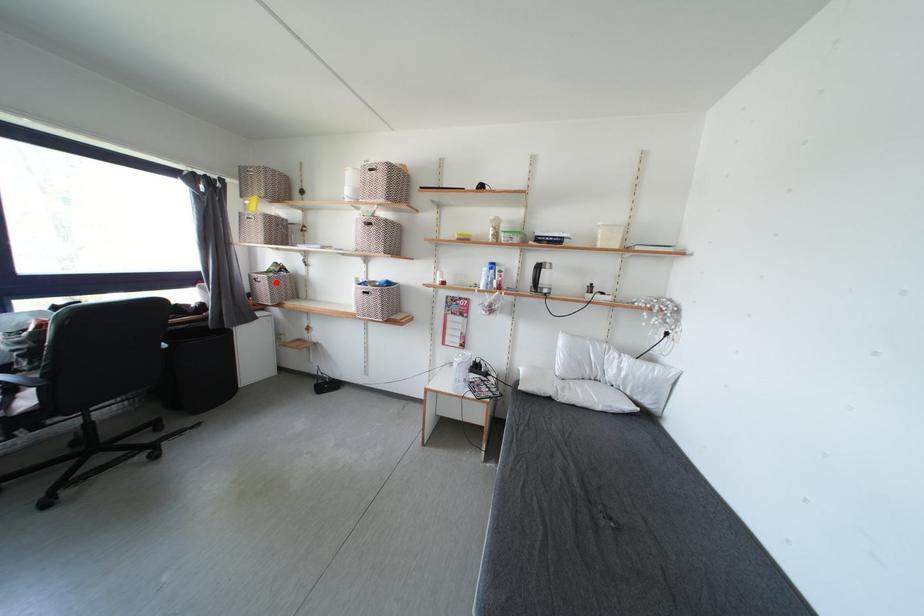
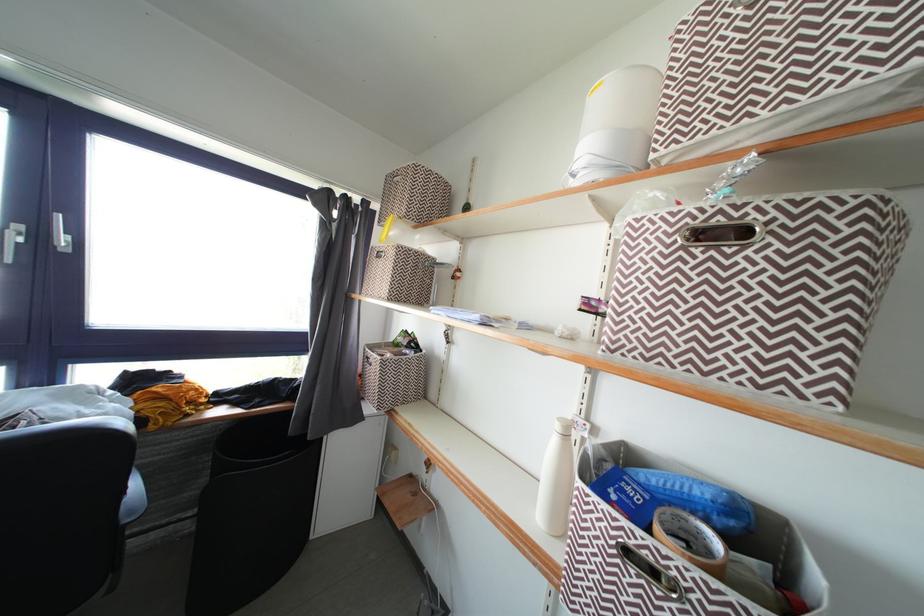
In the second image, find the point that corresponds to the highlighted location in the first image.

(390, 367)